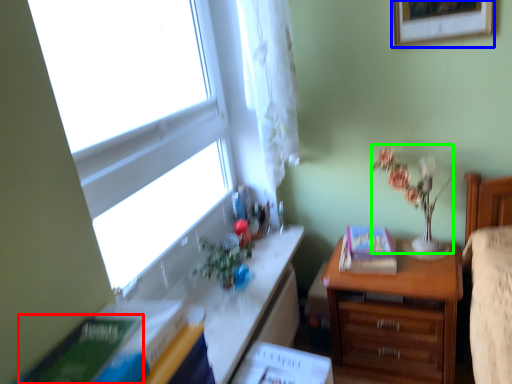
Question: Based on their relative distances, which object is farther from paperback book (highlighted by a red box)? Choose from picture frame (highlighted by a blue box) and floral arrangement (highlighted by a green box).

Choices:
 (A) picture frame
 (B) floral arrangement

Answer: (A)